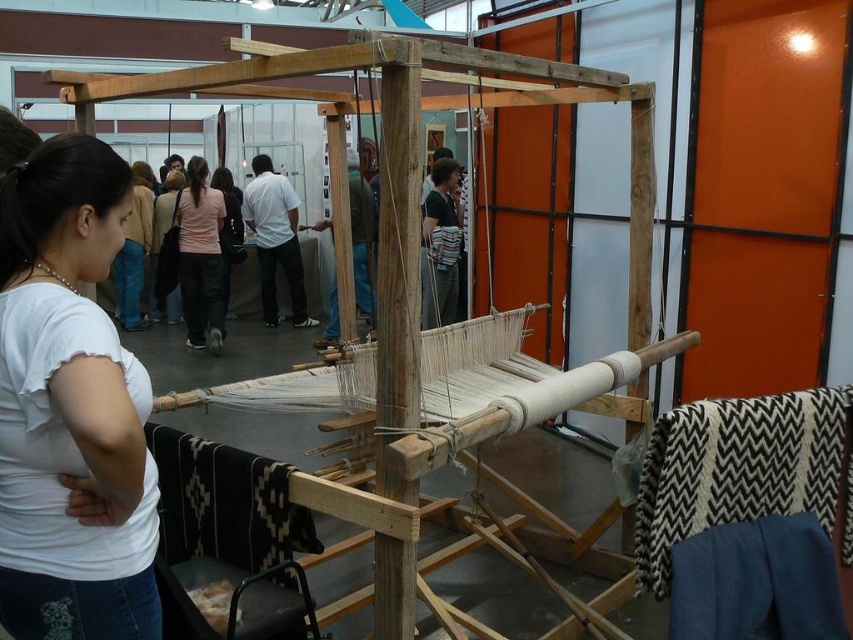
Which is in front, point (45, 458) or point (184, 282)?

Point (45, 458) is in front.

Does white cotton shirt at left appear over pink fabric at center?

Actually, white cotton shirt at left is below pink fabric at center.

This screenshot has height=640, width=853. Describe the element at coordinates (70, 410) in the screenshot. I see `white cotton shirt at left` at that location.

At what (x,y) coordinates should I click in order to perform the action: click on white cotton shirt at left. Please return your answer as a coordinate pair (x, y). Looking at the image, I should click on (70, 410).

Between black and white zigzag fabric at lower right and pink fabric at center, which one is positioned lower?

black and white zigzag fabric at lower right is below.

Consider the image. Is black and white zigzag fabric at lower right positioned behind pink fabric at center?

No, it is not.

Between point (846, 474) and point (190, 243), which one is positioned in front?

Point (846, 474)

The width and height of the screenshot is (853, 640). What are the coordinates of `black and white zigzag fabric at lower right` in the screenshot? It's located at pyautogui.click(x=735, y=468).

Can you confirm if white cotton shirt at left is positioned below black and white zigzag fabric at lower right?

No.

Is white cotton shirt at left above black and white zigzag fabric at lower right?

Indeed, white cotton shirt at left is positioned over black and white zigzag fabric at lower right.

Image resolution: width=853 pixels, height=640 pixels. Describe the element at coordinates (70, 410) in the screenshot. I see `white cotton shirt at left` at that location.

Where is `white cotton shirt at left`? Image resolution: width=853 pixels, height=640 pixels. white cotton shirt at left is located at coordinates (x=70, y=410).